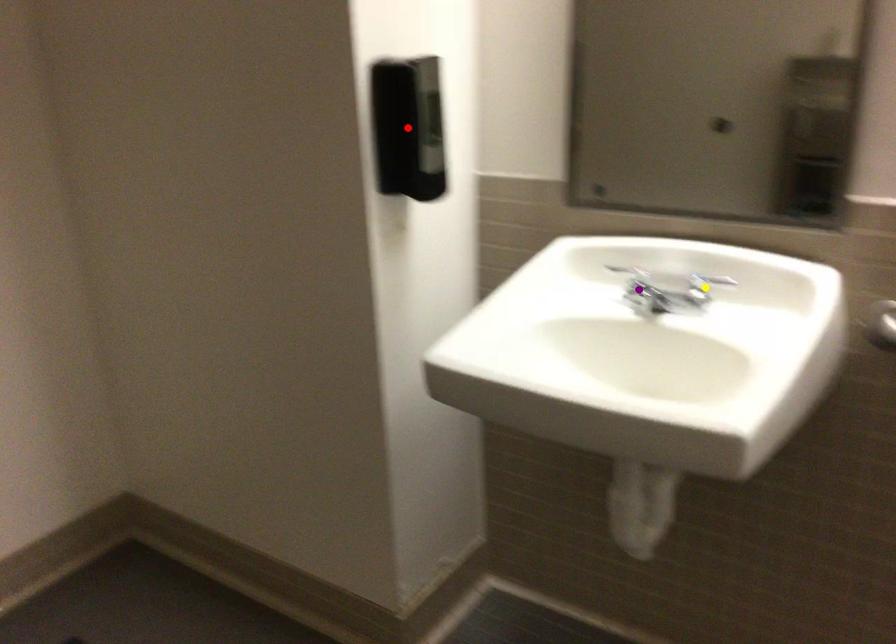
Order these from nearest to farthest:
1. red point
2. yellow point
3. purple point

1. red point
2. yellow point
3. purple point